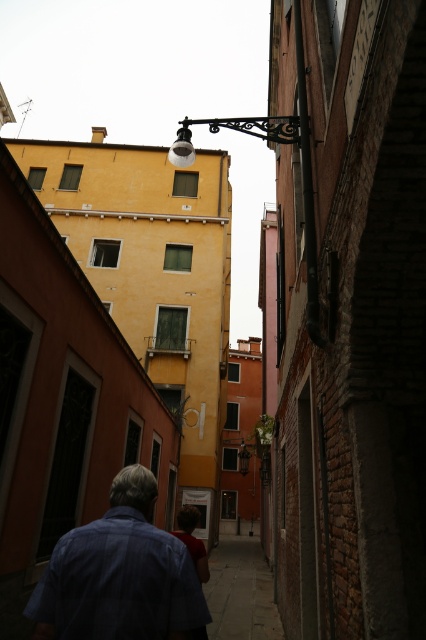
Is blue cotton shirt at lower left below paved stone sidewalk at center?

No.

Who is taller, blue cotton shirt at lower left or paved stone sidewalk at center?

Standing taller between the two is paved stone sidewalk at center.

Does point (106, 518) come behind point (259, 632)?

That is False.

Where is `blue cotton shirt at lower left`? This screenshot has height=640, width=426. blue cotton shirt at lower left is located at coordinates (118, 573).